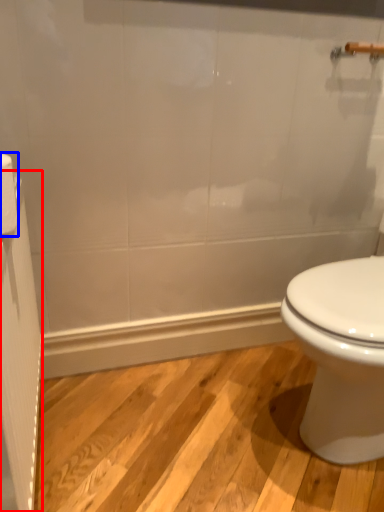
Question: Which point is further to the camera, screen door (highlighted by a red box) or toilet paper (highlighted by a blue box)?

Choices:
 (A) screen door
 (B) toilet paper

Answer: (B)